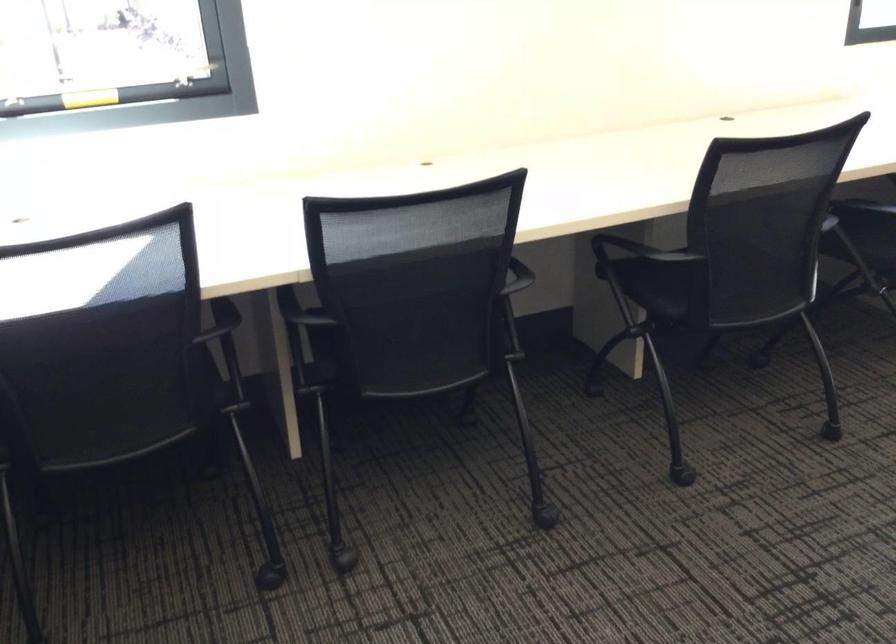
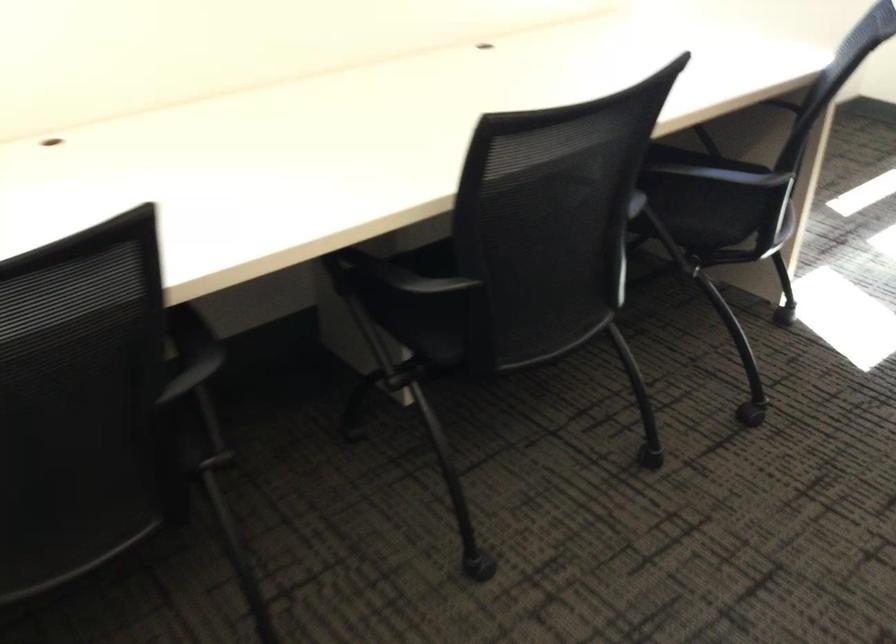
Question: The camera is either moving clockwise (left) or counter-clockwise (right) around the object. The first image is from the beginning of the video and the second image is from the end. Is the camera moving left or right when shooting the video?

Choices:
 (A) Left
 (B) Right

Answer: (A)